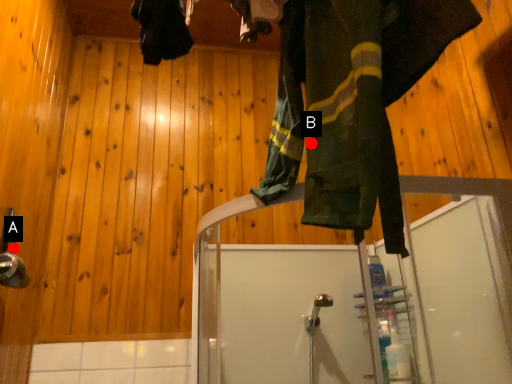
Question: Two points are circled on the image, labeled by A and B beside each circle. Among these points, which one is farthest from the camera?

Choices:
 (A) A is further
 (B) B is further

Answer: (A)